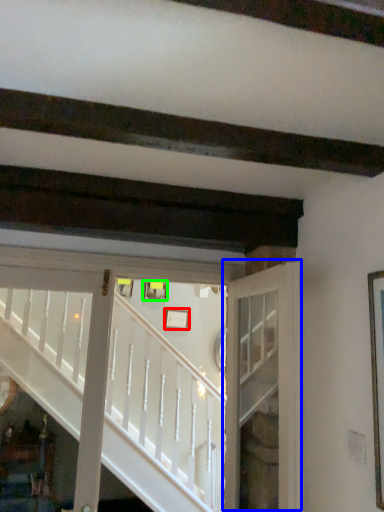
Question: Which object is the closest to the picture frame (highlighted by a red box)? Choose among these: door (highlighted by a blue box) or picture frame (highlighted by a green box).

Choices:
 (A) door
 (B) picture frame

Answer: (B)